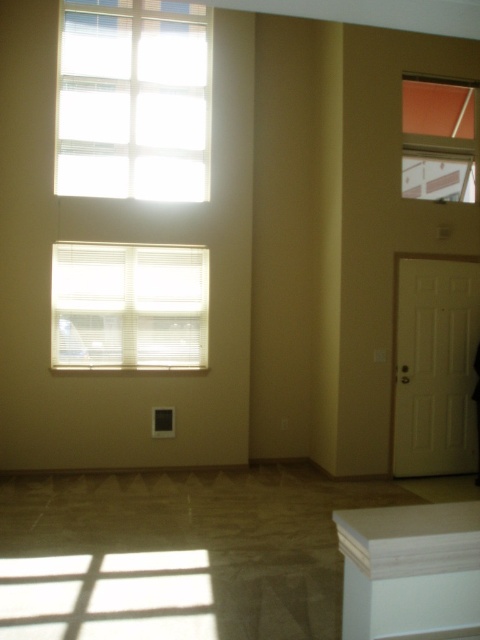
You are standing in the living room and want to exit through the door. You see the white wood cabinet at lower right and the matte glass window at upper right. Which object is closer to the door?

The white wood cabinet at lower right is closer to the door because it is positioned to the left of the matte glass window at upper right, which is further away from the door.